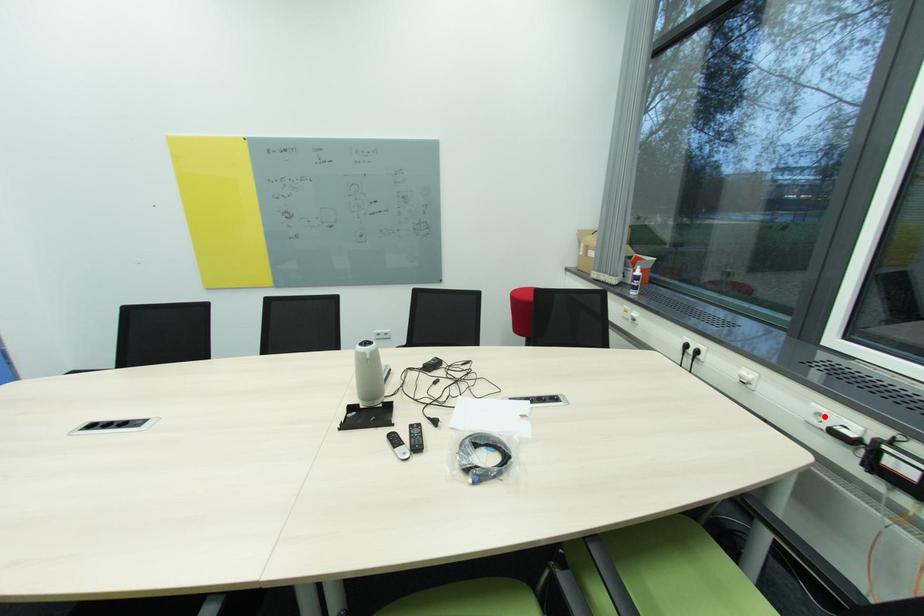
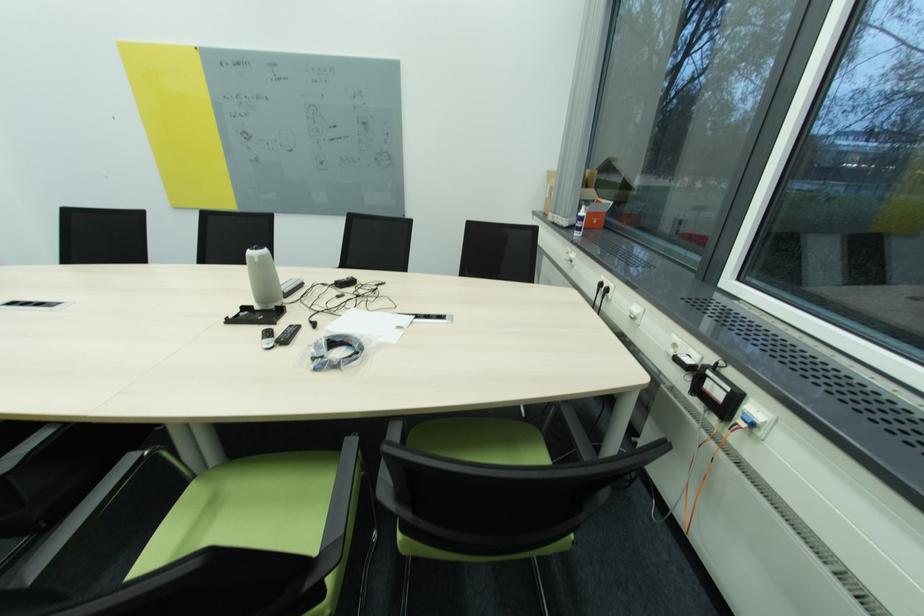
Question: I am providing you with two images of the same scene from different viewpoints. A red point is shown in image1. For the corresponding object point in image2, is it positioned nearer or farther from the camera?

Choices:
 (A) Nearer
 (B) Farther

Answer: (A)